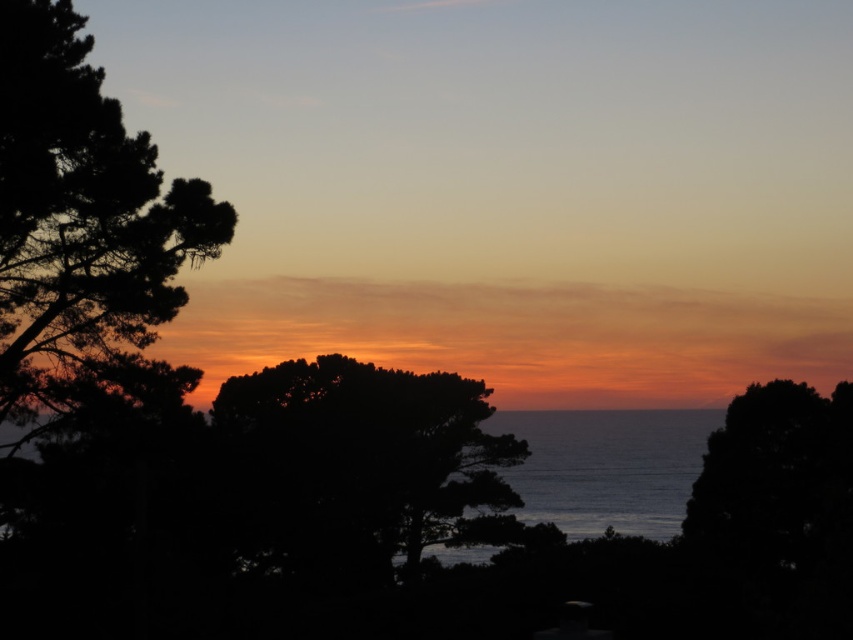
You are an artist trying to paint this sunset scene. You want to focus on the dark green leafy tree at center and the blue water at center. Which of these two elements should you make larger in your painting to stay true to the actual scene?

The blue water at center should be made larger in the painting because it occupies more space than the dark green leafy tree at center in the actual scene.

You are standing in the sunset scene and notice a specific point marked at coordinates (360, 465). Which object in the scene does this point correspond to?

The point at coordinates (360, 465) is located on the dark green leafy tree at center.